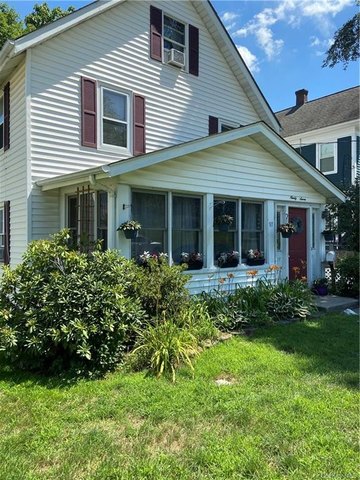
Find the location of a particular element. The image size is (360, 480). air conditioner is located at coordinates (174, 55).